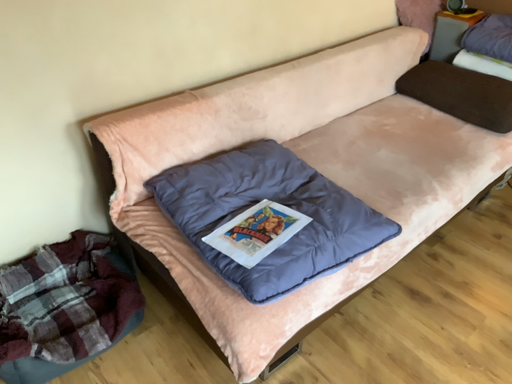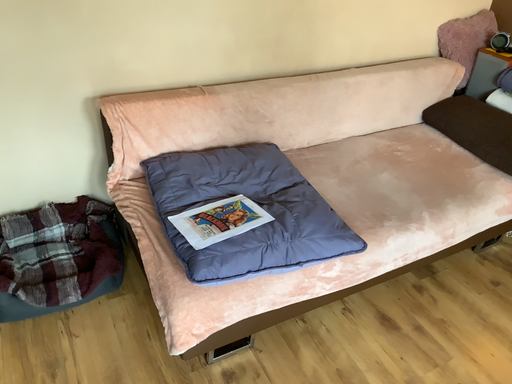
Question: How did the camera likely rotate when shooting the video?

Choices:
 (A) rotated right
 (B) rotated left

Answer: (B)